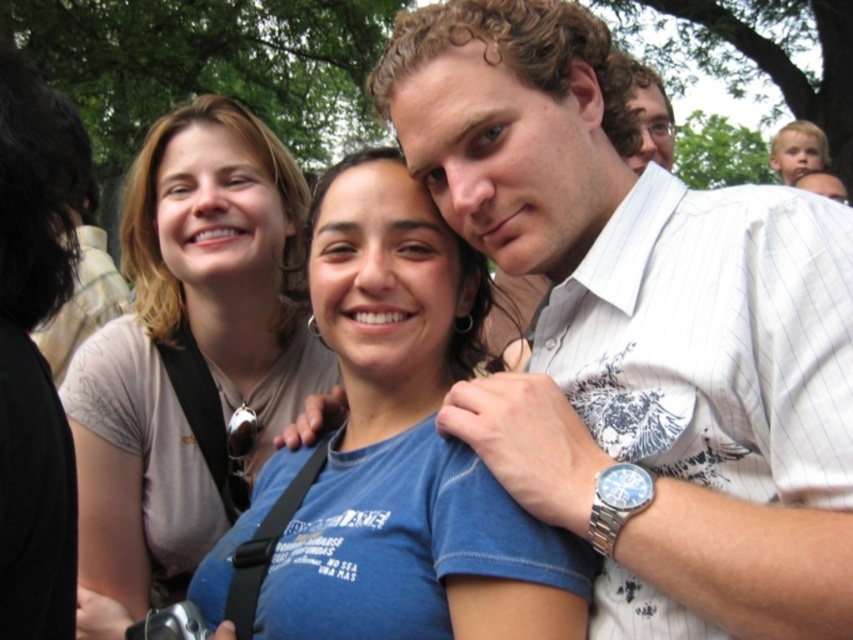
This screenshot has width=853, height=640. What do you see at coordinates (641, 328) in the screenshot? I see `white pinstriped shirt at center` at bounding box center [641, 328].

Can you confirm if white pinstriped shirt at center is positioned to the right of matte black glasses at upper center?

Incorrect, white pinstriped shirt at center is not on the right side of matte black glasses at upper center.

Is point (544, 81) less distant than point (659, 116)?

Yes, point (544, 81) is in front of point (659, 116).

What are the coordinates of `white pinstriped shirt at center` in the screenshot? It's located at (641, 328).

Is blue cotton shirt at center thinner than matte beige shirt at upper left?

In fact, blue cotton shirt at center might be wider than matte beige shirt at upper left.

This screenshot has height=640, width=853. What do you see at coordinates (407, 448) in the screenshot? I see `blue cotton shirt at center` at bounding box center [407, 448].

Locate an element on the screen. This screenshot has height=640, width=853. blue cotton shirt at center is located at coordinates (407, 448).

The height and width of the screenshot is (640, 853). In order to click on blue cotton shirt at center in this screenshot , I will do `click(407, 448)`.

Is blue cotton shirt at center taller than matte black glasses at upper center?

Correct, blue cotton shirt at center is much taller as matte black glasses at upper center.

Can you confirm if blue cotton shirt at center is shorter than matte black glasses at upper center?

No, blue cotton shirt at center is not shorter than matte black glasses at upper center.

This screenshot has height=640, width=853. What are the coordinates of `blue cotton shirt at center` in the screenshot? It's located at (407, 448).

Find the location of a particular element. The height and width of the screenshot is (640, 853). blue cotton shirt at center is located at coordinates (407, 448).